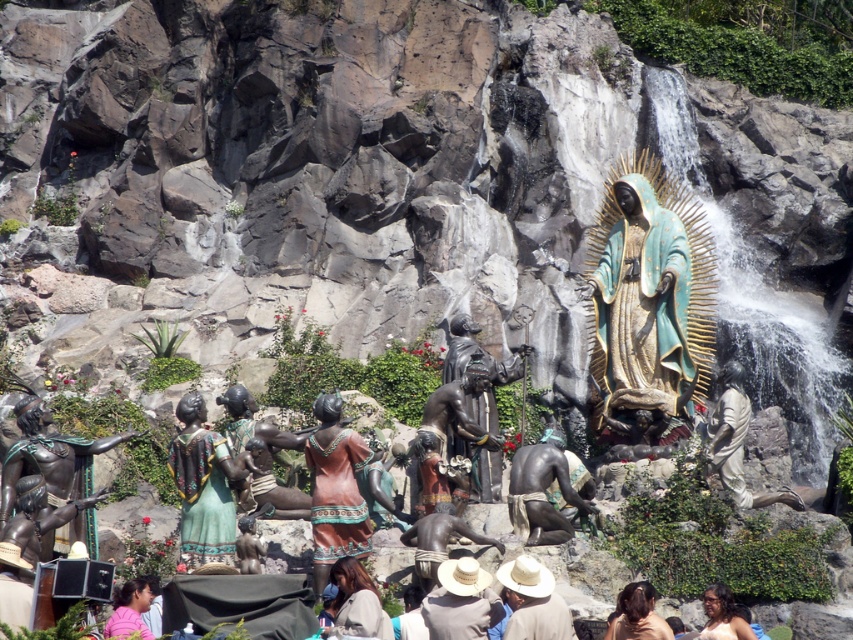
Is bronze statue at lower center further to the viewer compared to bronze statue at center?

No, it is in front of bronze statue at center.

Does bronze statue at lower center appear over bronze statue at center?

Incorrect, bronze statue at lower center is not positioned above bronze statue at center.

Does point (538, 461) come in front of point (456, 336)?

Yes, it is in front of point (456, 336).

Locate an element on the screen. bronze statue at lower center is located at coordinates (541, 492).

Which is in front, point (715, 608) or point (119, 621)?

Point (119, 621) is in front.

Is matte brown hair at center wider than pink fabric at lower left?

Incorrect, matte brown hair at center's width does not surpass pink fabric at lower left's.

This screenshot has height=640, width=853. Find the location of `matte brown hair at center`. matte brown hair at center is located at coordinates (723, 616).

Does bronze statue at lower center have a greater height compared to brown hair at lower center?

Indeed, bronze statue at lower center has a greater height compared to brown hair at lower center.

Which of these two, bronze statue at lower center or brown hair at lower center, stands shorter?

With less height is brown hair at lower center.

Which is behind, point (555, 515) or point (648, 593)?

Point (555, 515)

The image size is (853, 640). I want to click on bronze statue at lower center, so click(x=541, y=492).